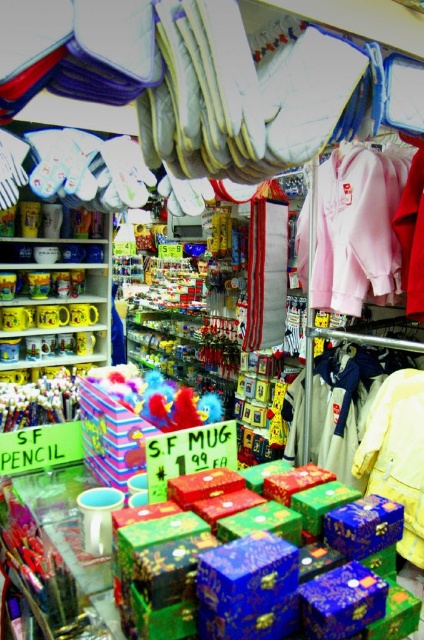
Measure the distance between shiny metallic boxes at center and camera.

shiny metallic boxes at center is 31.34 inches from camera.

Does shiny metallic boxes at center appear on the left side of white cotton jacket at center?

Correct, you'll find shiny metallic boxes at center to the left of white cotton jacket at center.

Locate an element on the screen. The width and height of the screenshot is (424, 640). shiny metallic boxes at center is located at coordinates (256, 572).

Is point (184, 588) closer to camera compared to point (50, 388)?

That is True.

Does shiny metallic boxes at center have a larger size compared to matte plastic pencils at left?

Correct, shiny metallic boxes at center is larger in size than matte plastic pencils at left.

Which is behind, point (339, 554) or point (75, 387)?

Point (75, 387)

Identify the location of shiny metallic boxes at center. The height and width of the screenshot is (640, 424). 256,572.

What do you see at coordinates (354, 227) in the screenshot? I see `pink fleece hoodie at upper right` at bounding box center [354, 227].

Which is behind, point (390, 289) or point (410, 264)?

Positioned behind is point (390, 289).

The image size is (424, 640). Find the location of `pink fleece hoodie at upper right`. pink fleece hoodie at upper right is located at coordinates (354, 227).